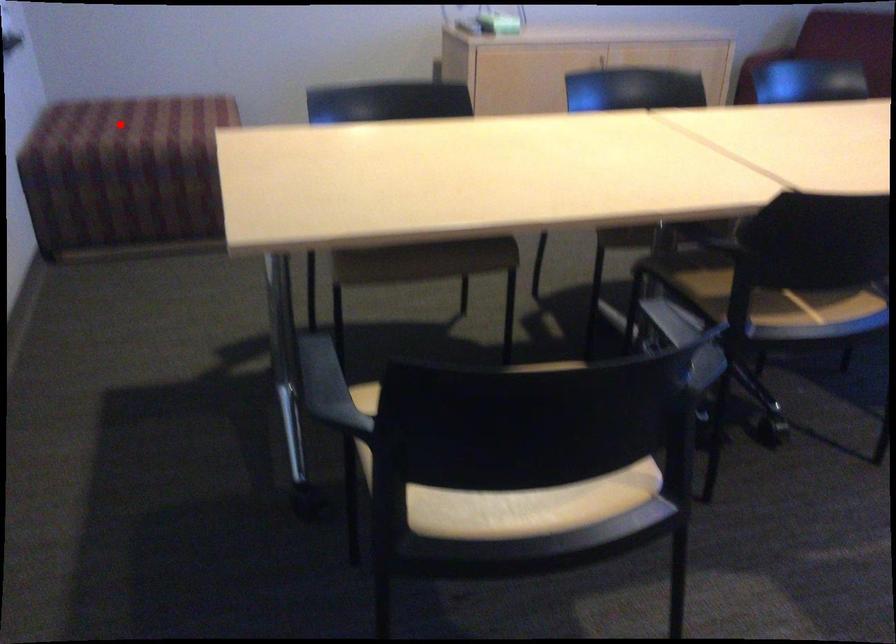
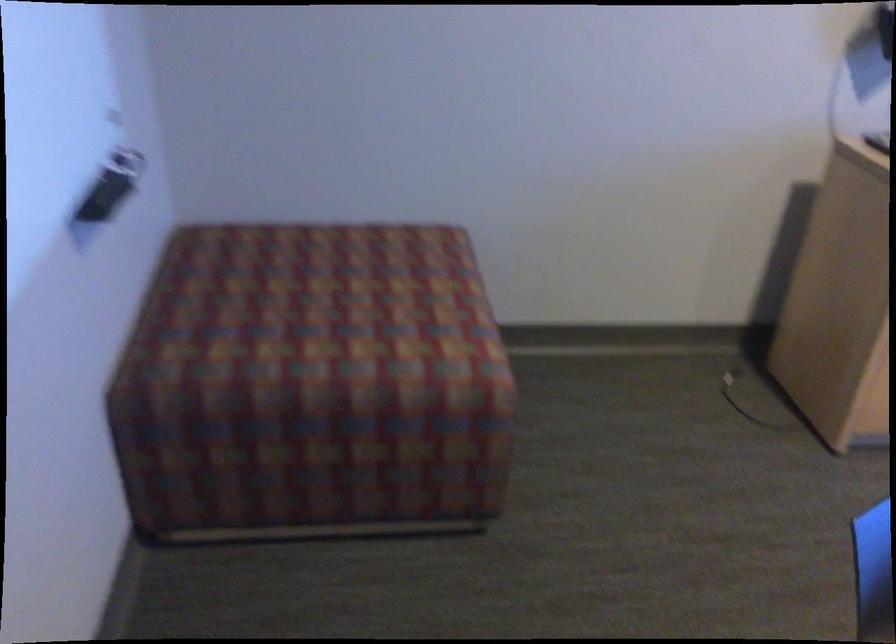
Locate, in the second image, the point that corresponds to the highlighted location in the first image.

(332, 301)